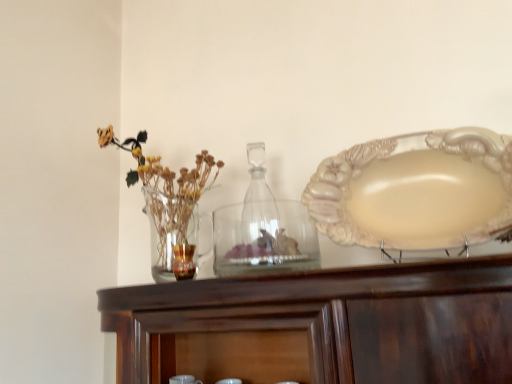
Question: In terms of width, does translucent glass candle at center, which is counted as the first tableware, starting from the left, look wider or thinner when compared to clear glass jar at center, the 2th tableware viewed from the left?

Choices:
 (A) thin
 (B) wide

Answer: (A)

Question: In terms of size, does translucent glass candle at center, which is the 2th tableware from right to left, appear bigger or smaller than clear glass jar at center, the 2th tableware viewed from the left?

Choices:
 (A) small
 (B) big

Answer: (A)

Question: Based on their relative distances, which object is farther from the matte cream plate at right?

Choices:
 (A) transparent glass bottle at center
 (B) translucent glass candle at center, which is the 2th tableware from right to left
 (C) clear glass jar at center, placed as the first tableware when sorted from right to left
 (D) translucent glass vase at left

Answer: (D)

Question: Which object is positioned farthest from the translucent glass vase at left?

Choices:
 (A) translucent glass candle at center, which is the 2th tableware from right to left
 (B) clear glass jar at center, placed as the first tableware when sorted from right to left
 (C) transparent glass bottle at center
 (D) matte cream plate at right

Answer: (D)